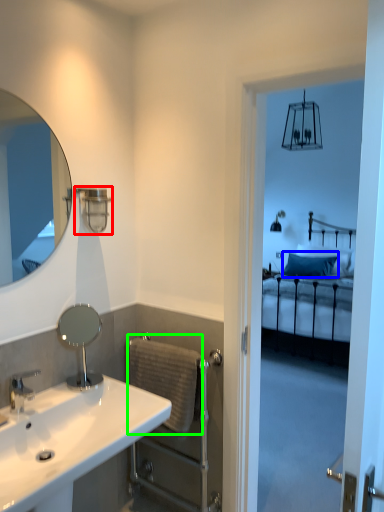
Question: Estimate the real-world distances between objects in this image. Which object is closer to shower (highlighted by a red box), pillow (highlighted by a blue box) or towel bar (highlighted by a green box)?

Choices:
 (A) pillow
 (B) towel bar

Answer: (B)